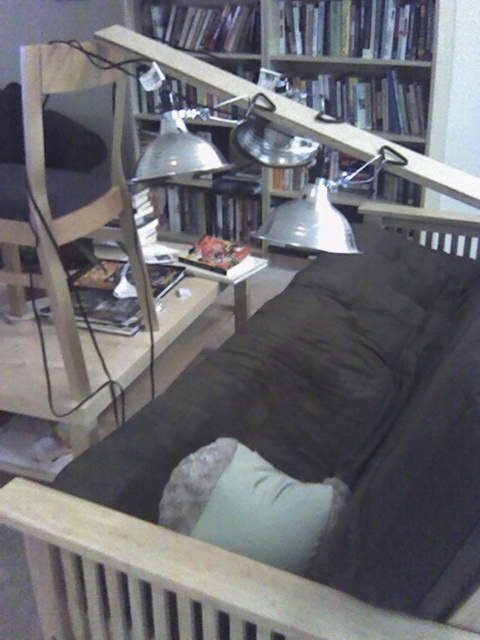
Is wooden chair at left shorter than light gray fabric pillow at lower center?

In fact, wooden chair at left may be taller than light gray fabric pillow at lower center.

Who is positioned more to the left, wooden chair at left or light gray fabric pillow at lower center?

wooden chair at left

Which is in front, point (27, 205) or point (220, 440)?

Positioned in front is point (220, 440).

Identify the location of wooden chair at left. (69, 204).

Which is in front, point (175, 20) or point (207, 508)?

Point (207, 508)

From the picture: Is the position of metallic/reflective bookcase at upper center less distant than that of light gray fabric pillow at lower center?

No, it is not.

The image size is (480, 640). Describe the element at coordinates (333, 64) in the screenshot. I see `metallic/reflective bookcase at upper center` at that location.

Find the location of a particular element. The image size is (480, 640). metallic/reflective bookcase at upper center is located at coordinates (333, 64).

Is dark fabric couch at center taller than wooden chair at left?

Indeed, dark fabric couch at center has a greater height compared to wooden chair at left.

Is point (228, 637) farther from viewer compared to point (92, 60)?

No, it is in front of (92, 60).

Who is more forward, (468, 472) or (146, 316)?

Positioned in front is point (468, 472).

Image resolution: width=480 pixels, height=640 pixels. Identify the location of dark fabric couch at center. (286, 467).